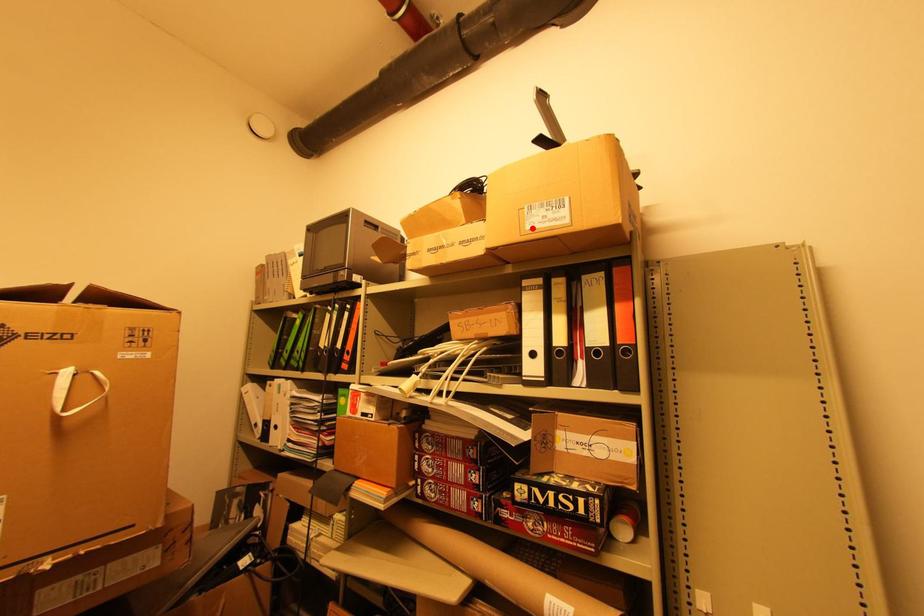
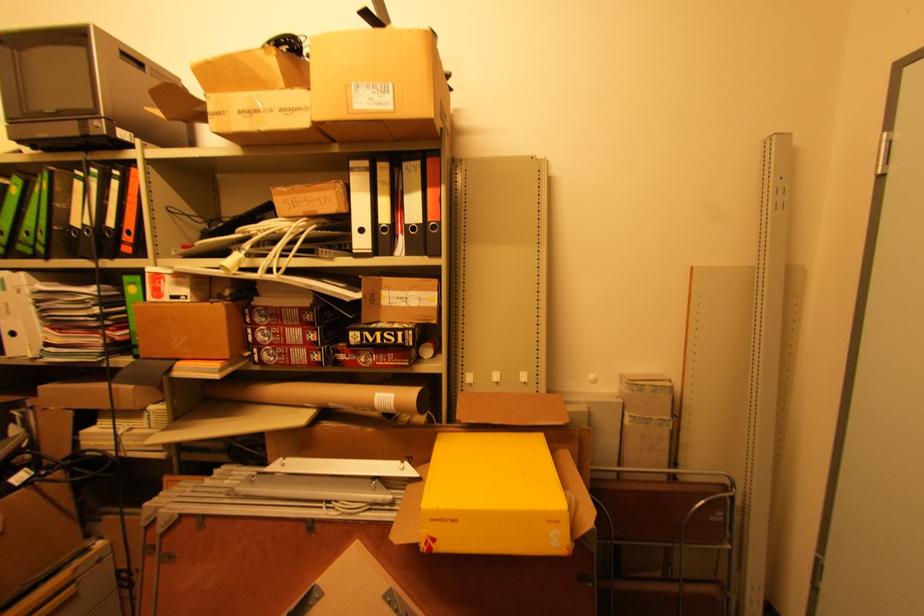
In the second image, find the point that corresponds to the highlighted location in the first image.

(359, 107)